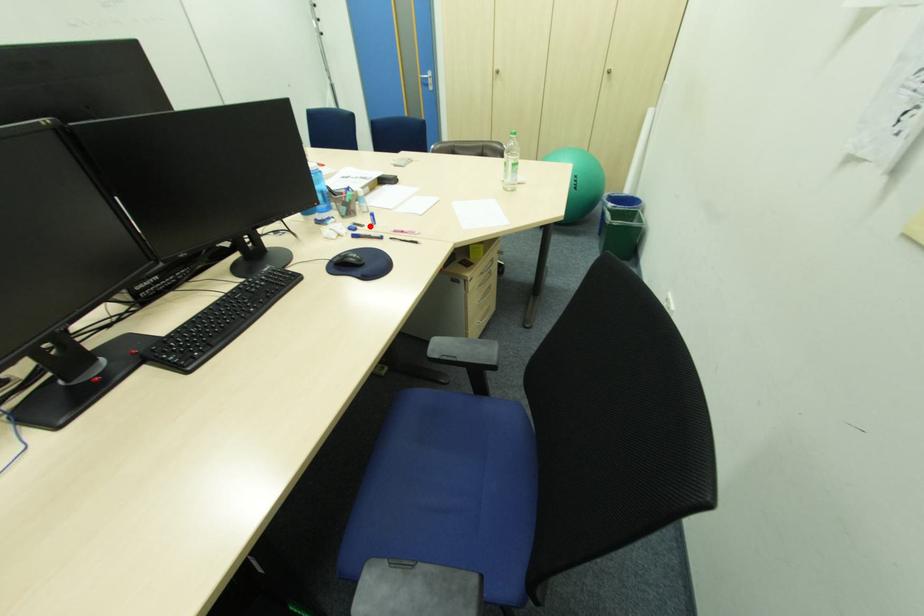
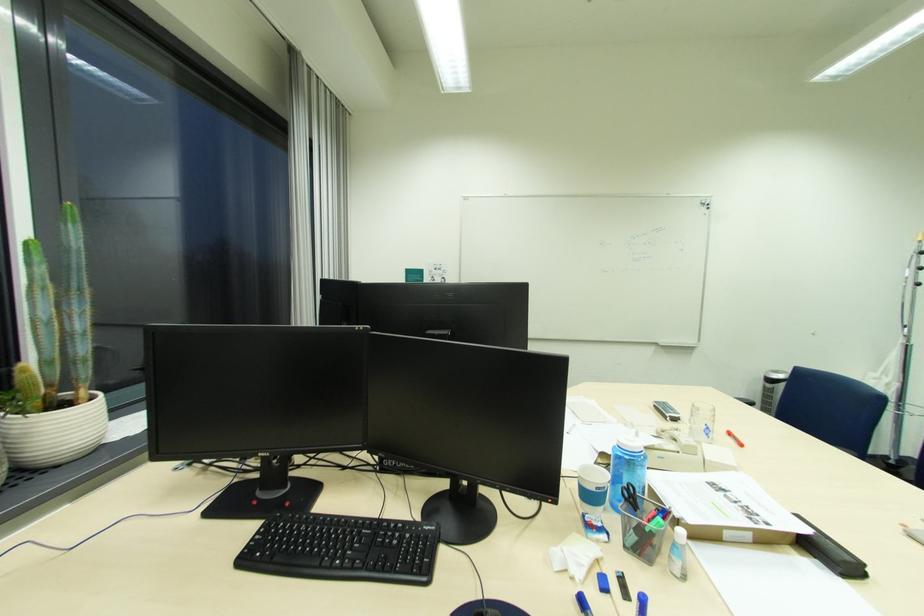
Where in the second image is the point corresponding to the highlighted location from the first image?

(636, 601)